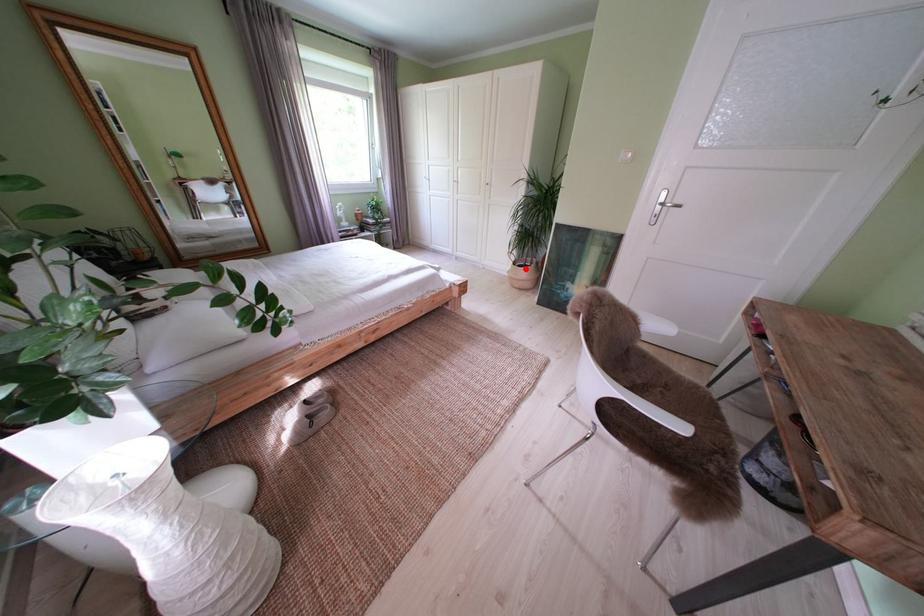
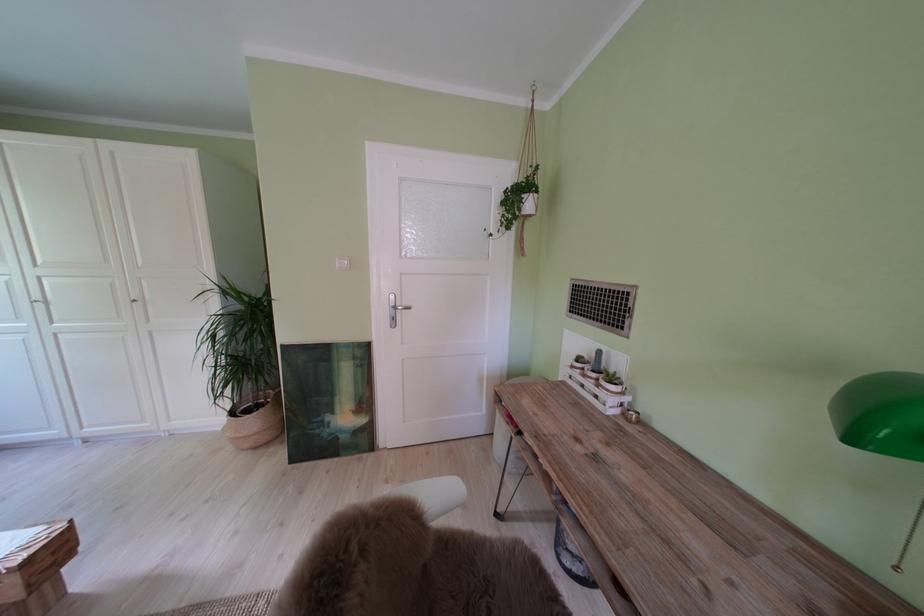
Find the pixel in the second image that matches the highlighted location in the first image.

(242, 418)